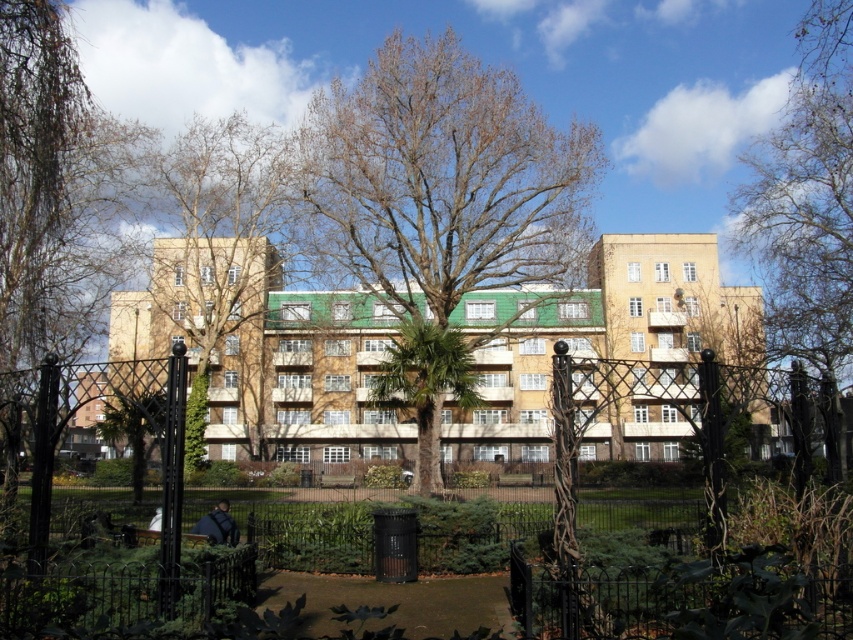
You are standing in front of the black metal fence in the urban park scene. You see a bare wood tree at center and a bare branches at center. Which one is positioned to the right side?

The bare wood tree at center is to the right of the bare branches at center.